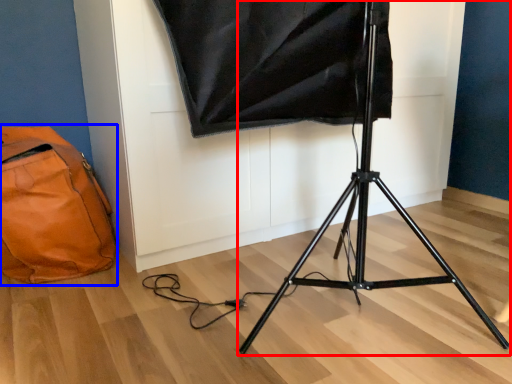
Question: Among these objects, which one is farthest to the camera, tripod (highlighted by a red box) or bag (highlighted by a blue box)?

Choices:
 (A) tripod
 (B) bag

Answer: (B)